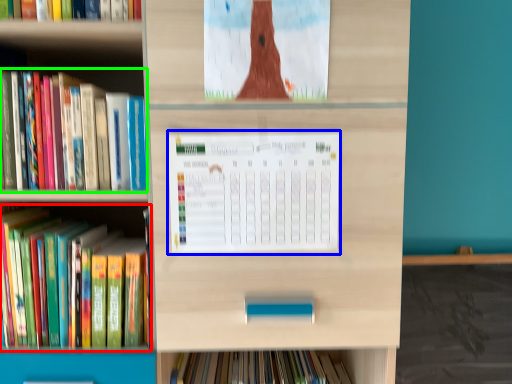
Question: Considering the real-world distances, which object is farthest from book (highlighted by a red box)? paperback book (highlighted by a blue box) or book (highlighted by a green box)?

Choices:
 (A) paperback book
 (B) book

Answer: (A)